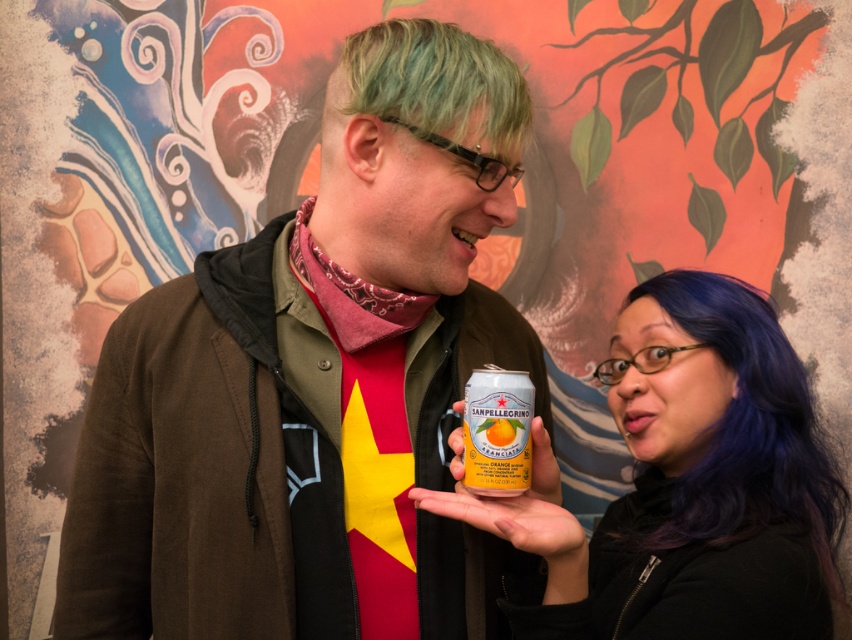
Which is behind, point (746, 449) or point (531, 540)?

Positioned behind is point (746, 449).

Does shiny metallic can at center appear over yellow matte can at center?

Incorrect, shiny metallic can at center is not positioned above yellow matte can at center.

Between point (655, 433) and point (491, 531), which one is positioned in front?

Point (491, 531)

This screenshot has width=852, height=640. In order to click on shiny metallic can at center in this screenshot , I will do `click(691, 484)`.

Can you confirm if yellow matte can at center is positioned above metallic silver can at center?

No.

Does point (542, 422) come farther from viewer compared to point (473, 419)?

Yes, point (542, 422) is behind point (473, 419).

Is point (557, 548) less distant than point (481, 372)?

Yes, point (557, 548) is in front of point (481, 372).

The width and height of the screenshot is (852, 640). I want to click on yellow matte can at center, so click(x=519, y=509).

Image resolution: width=852 pixels, height=640 pixels. What do you see at coordinates (438, 84) in the screenshot? I see `green dyed hair at upper center` at bounding box center [438, 84].

Is point (390, 52) behind point (492, 445)?

Yes.

This screenshot has height=640, width=852. What do you see at coordinates (438, 84) in the screenshot?
I see `green dyed hair at upper center` at bounding box center [438, 84].

Where is `green dyed hair at upper center`? This screenshot has height=640, width=852. green dyed hair at upper center is located at coordinates (438, 84).